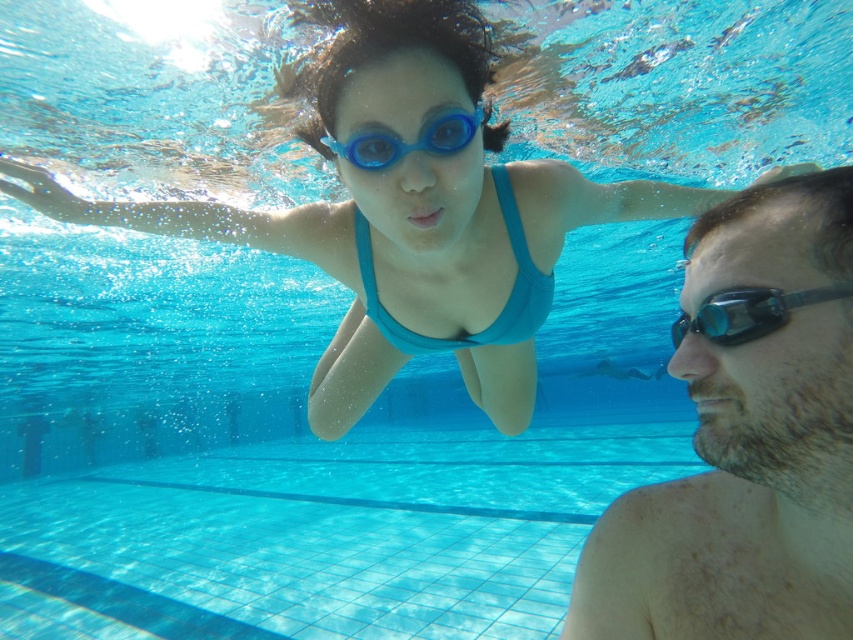
Can you confirm if blue matte swimsuit at center is smaller than blue rubber goggles at center?

No, blue matte swimsuit at center is not smaller than blue rubber goggles at center.

Does blue matte swimsuit at center have a lesser height compared to blue rubber goggles at center?

No, blue matte swimsuit at center is not shorter than blue rubber goggles at center.

Which is behind, point (489, 316) or point (376, 161)?

Point (489, 316)

Where is `blue matte swimsuit at center`? Image resolution: width=853 pixels, height=640 pixels. blue matte swimsuit at center is located at coordinates (347, 256).

Does point (502, 212) lie in front of point (843, 284)?

No, it is behind (843, 284).

Is teal fabric bikini top at center to the left of transparent rubber goggles at right from the viewer's perspective?

Correct, you'll find teal fabric bikini top at center to the left of transparent rubber goggles at right.

Between point (523, 250) and point (799, 296), which one is positioned behind?

Point (523, 250)

Where is `teal fabric bikini top at center`? teal fabric bikini top at center is located at coordinates (503, 305).

Is point (770, 310) positioned in front of point (462, 134)?

Yes, point (770, 310) is in front of point (462, 134).

Who is taller, transparent rubber goggles at right or blue rubber goggles at center?

With more height is blue rubber goggles at center.

What do you see at coordinates (749, 312) in the screenshot? This screenshot has height=640, width=853. I see `transparent rubber goggles at right` at bounding box center [749, 312].

Locate an element on the screen. transparent rubber goggles at right is located at coordinates (749, 312).